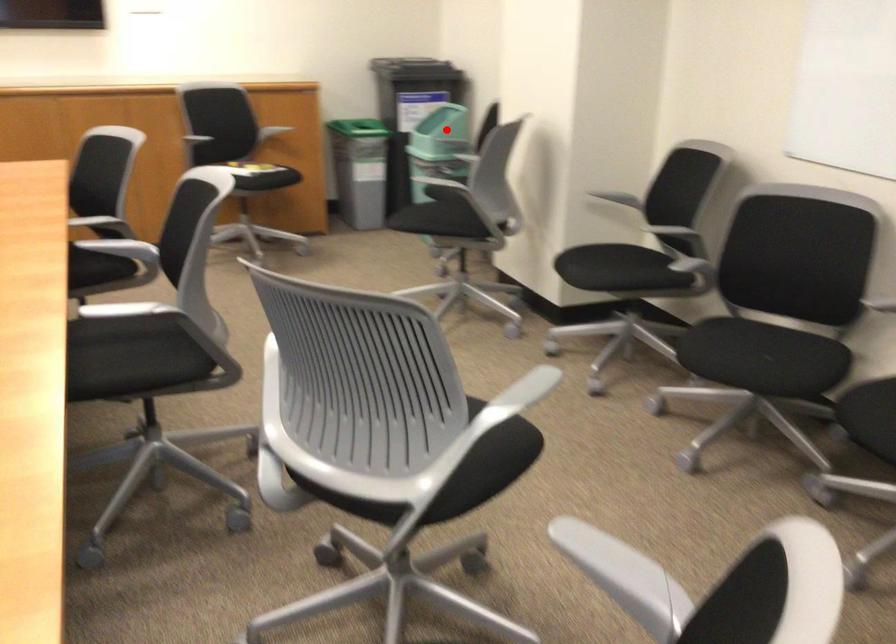
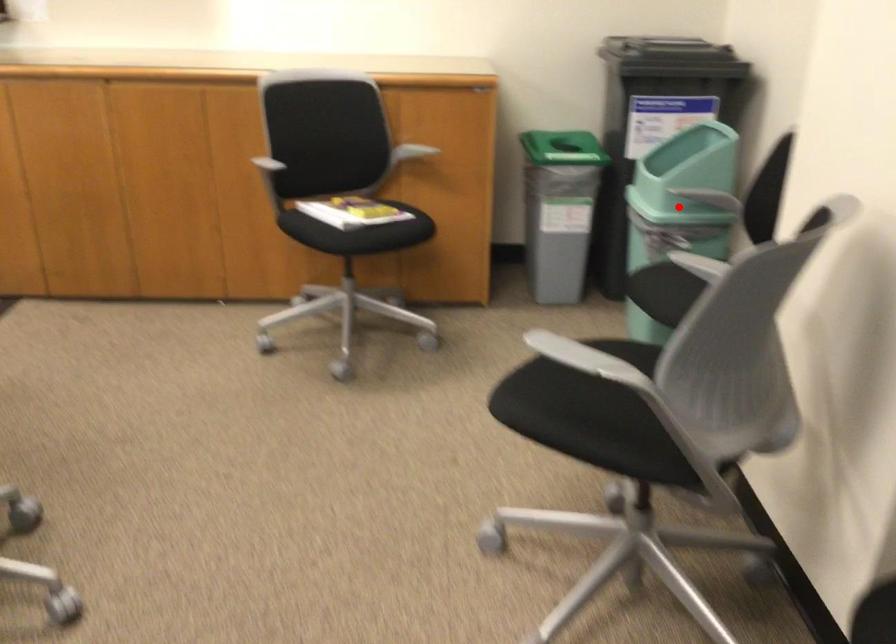
I am providing you with two images of the same scene from different viewpoints. A red point is marked on the first image and another point is marked on the second image. Is the red point in image1 aligned with the point shown in image2?

Yes